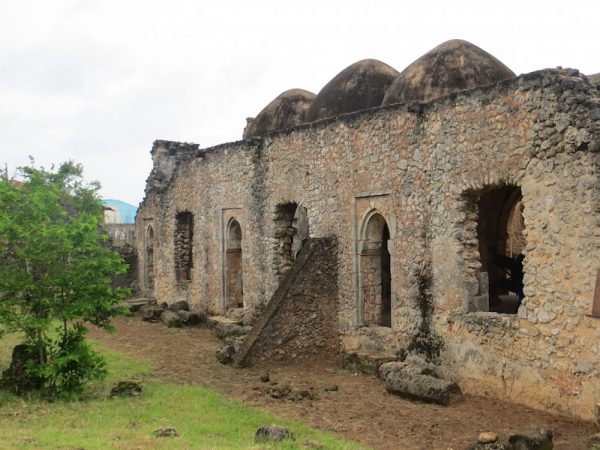
Where is `top of wall`? This screenshot has height=450, width=600. top of wall is located at coordinates (312, 122).